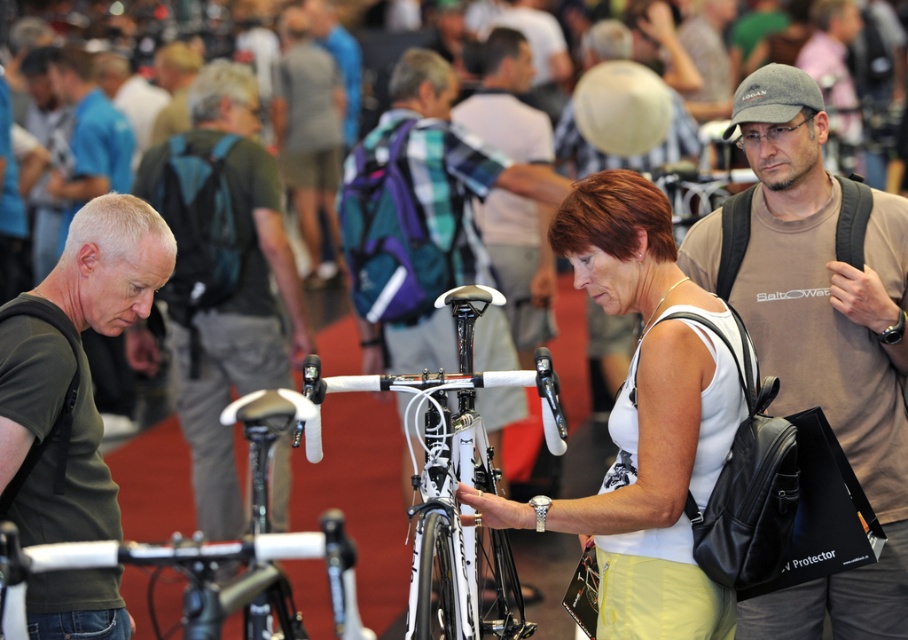
You are a photographer at the event and need to capture both the green fabric backpack at center and the white matte bicycle handlebars at center in a single frame. Since your camera has a limited field of view, which object should you position closer to the lens to ensure both are in focus?

The green fabric backpack at center is bigger than the white matte bicycle handlebars at center. To ensure both are in focus, position the green fabric backpack at center closer to the lens since larger objects require more focus adjustment.